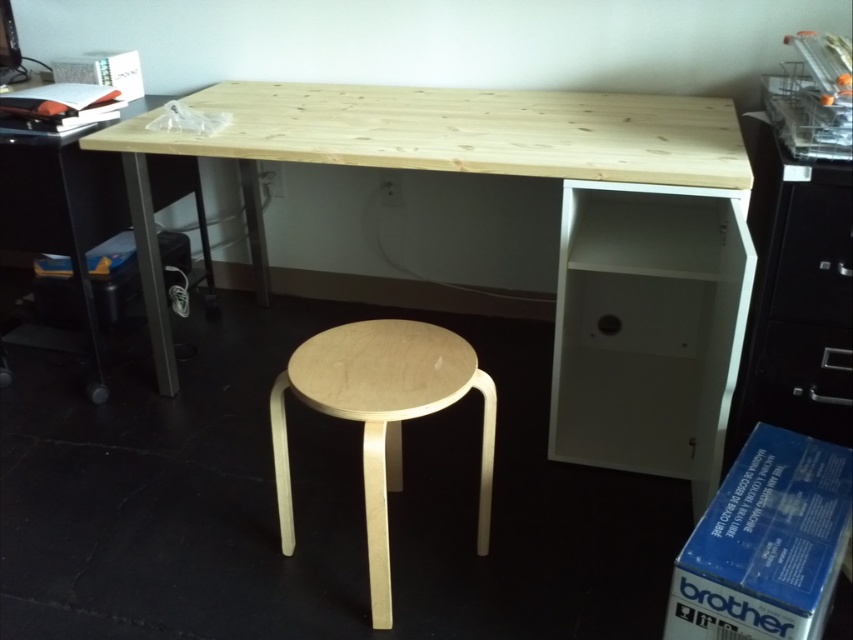
You need to store a large document folder. Based on the workspace setup, which object between the black plastic file cabinet at right and the white matte drawer at center would be more suitable for storing it?

The black plastic file cabinet at right is bigger than the white matte drawer at center, so it would be more suitable for storing a large document folder.

You are organizing your workspace and need to move a heavy box from the black plastic file cabinet at right to the white matte drawer at center. Can you slide the box directly between them without moving any other objects?

The black plastic file cabinet at right is in front of the white matte drawer at center, so sliding the box directly between them might not be possible without moving the file cabinet first.

You are standing in front of the desk and want to place a new object on the surface. The black plastic file cabinet at right is represented by point (796, 298). Where should you place the new object to ensure it doesn not interfere with the existing furniture?

The black plastic file cabinet at right is represented by point (796, 298). To avoid interference, place the new object away from this coordinate on the desk surface.